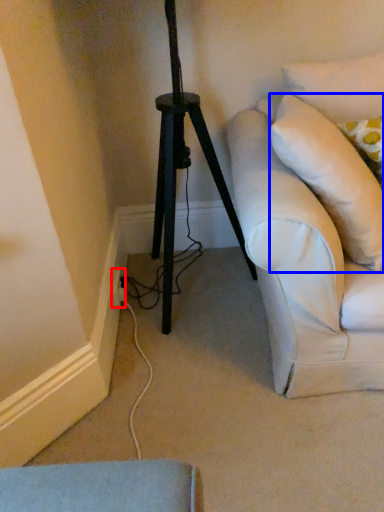
Question: Which object is closer to the camera taking this photo, electric outlet (highlighted by a red box) or pillow (highlighted by a blue box)?

Choices:
 (A) electric outlet
 (B) pillow

Answer: (B)